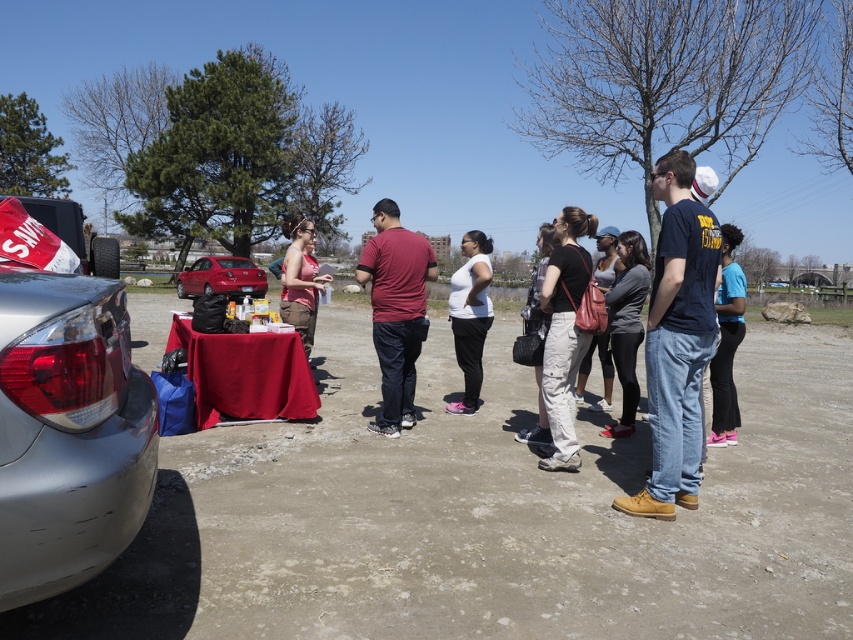
Question: Which object appears closest to the camera in this image?

Choices:
 (A) shiny red sedan at center
 (B) silver metallic car at left
 (C) white matte shirt at center

Answer: (B)

Question: Which point is farther to the camera?

Choices:
 (A) (543, 301)
 (B) (305, 275)

Answer: (B)

Question: Is gray fabric jacket at center positioned behind blue cotton shirt at right?

Choices:
 (A) yes
 (B) no

Answer: (A)

Question: Can you confirm if silver metallic car at left is positioned below matte pink tank top at center?

Choices:
 (A) no
 (B) yes

Answer: (B)

Question: Among these objects, which one is nearest to the camera?

Choices:
 (A) blue cotton shirt at right
 (B) white matte shirt at center

Answer: (A)

Question: Is matte black shirt at center below blue cotton shirt at right?

Choices:
 (A) yes
 (B) no

Answer: (B)